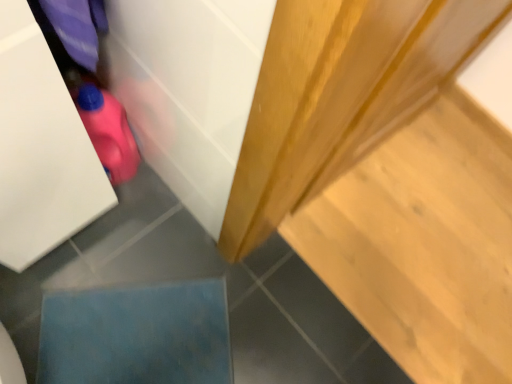
Question: Should I look upward or downward to see blue fabric at lower left?

Choices:
 (A) down
 (B) up

Answer: (A)

Question: Does pink rubber toy at lower left touch light wood stair at upper right?

Choices:
 (A) no
 (B) yes

Answer: (A)

Question: From the image's perspective, is pink rubber toy at lower left under light wood stair at upper right?

Choices:
 (A) no
 (B) yes

Answer: (A)

Question: Does pink rubber toy at lower left come behind light wood stair at upper right?

Choices:
 (A) no
 (B) yes

Answer: (A)

Question: Considering the relative sizes of pink rubber toy at lower left and light wood stair at upper right in the image provided, is pink rubber toy at lower left taller than light wood stair at upper right?

Choices:
 (A) no
 (B) yes

Answer: (B)

Question: Is pink rubber toy at lower left bigger than light wood stair at upper right?

Choices:
 (A) no
 (B) yes

Answer: (A)

Question: Is pink rubber toy at lower left thinner than light wood stair at upper right?

Choices:
 (A) no
 (B) yes

Answer: (B)

Question: Is the surface of blue fabric at lower left in direct contact with light wood stair at upper right?

Choices:
 (A) no
 (B) yes

Answer: (A)

Question: From a real-world perspective, is blue fabric at lower left physically below light wood stair at upper right?

Choices:
 (A) no
 (B) yes

Answer: (A)

Question: Is blue fabric at lower left far from light wood stair at upper right?

Choices:
 (A) yes
 (B) no

Answer: (B)

Question: From the image's perspective, does blue fabric at lower left appear higher than light wood stair at upper right?

Choices:
 (A) yes
 (B) no

Answer: (B)

Question: Is blue fabric at lower left positioned beyond the bounds of light wood stair at upper right?

Choices:
 (A) yes
 (B) no

Answer: (A)

Question: Is blue fabric at lower left bigger than light wood stair at upper right?

Choices:
 (A) no
 (B) yes

Answer: (A)

Question: From the image's perspective, would you say light wood stair at upper right is positioned over blue fabric at lower left?

Choices:
 (A) yes
 (B) no

Answer: (A)